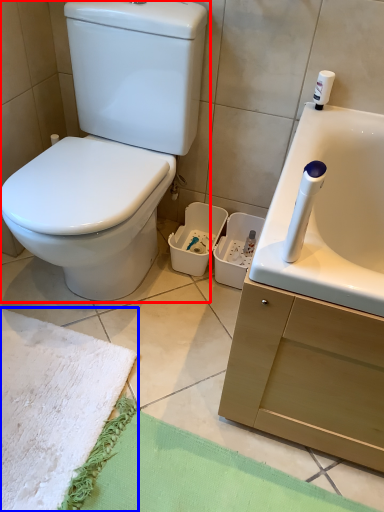
Question: Among these objects, which one is farthest to the camera, toilet (highlighted by a red box) or beach towel (highlighted by a blue box)?

Choices:
 (A) toilet
 (B) beach towel

Answer: (B)